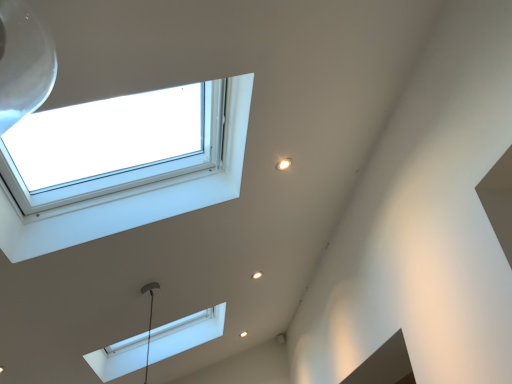
The width and height of the screenshot is (512, 384). Describe the element at coordinates (131, 196) in the screenshot. I see `clear glass window at upper left` at that location.

This screenshot has height=384, width=512. What are the coordinates of `clear glass window at upper left` in the screenshot? It's located at (131, 196).

What is the approximate height of clear glass window at upper left?

It is 45.53 centimeters.

The height and width of the screenshot is (384, 512). I want to click on clear glass window at upper left, so click(x=131, y=196).